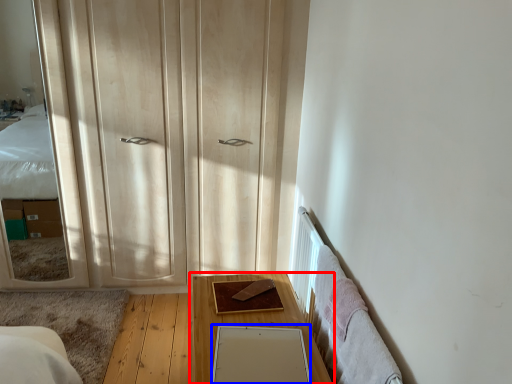
Question: Among these objects, which one is nearest to the camera, table (highlighted by a red box) or mirror (highlighted by a blue box)?

Choices:
 (A) table
 (B) mirror

Answer: (B)